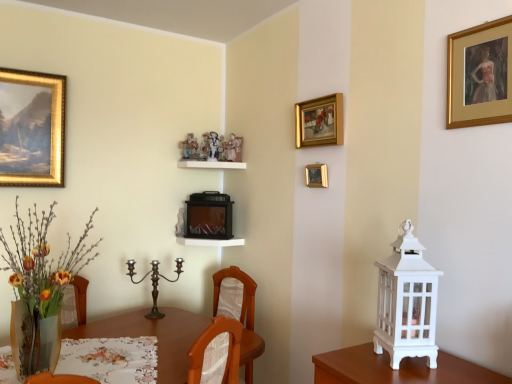
Identify the location of free space above floral lace tablecloth at lower left (from a real-world perspective). (96, 355).